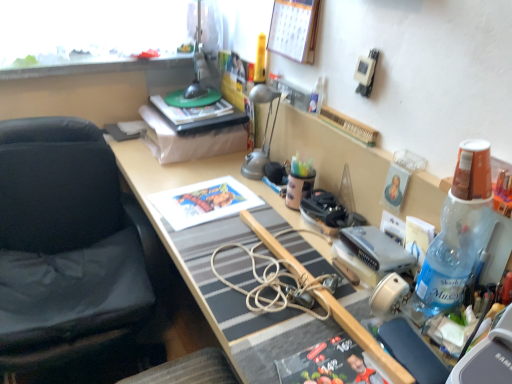
Locate an element on the screen. The image size is (512, 384). free space above hardcover book at center (from a real-world perspective) is located at coordinates (195, 105).